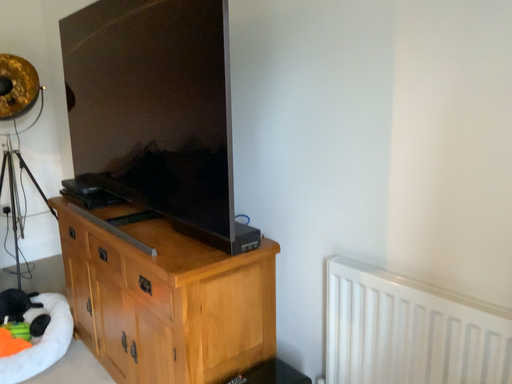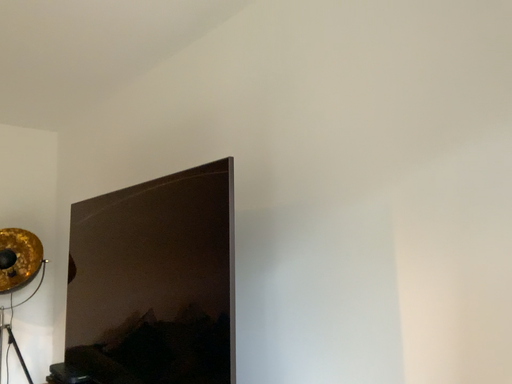
Question: Which way did the camera rotate in the video?

Choices:
 (A) rotated downward
 (B) rotated upward

Answer: (B)